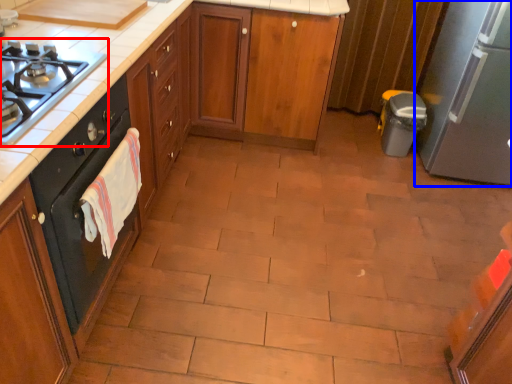
Question: Which point is further to the camera, gas stove (highlighted by a red box) or kitchen appliance (highlighted by a blue box)?

Choices:
 (A) gas stove
 (B) kitchen appliance

Answer: (B)